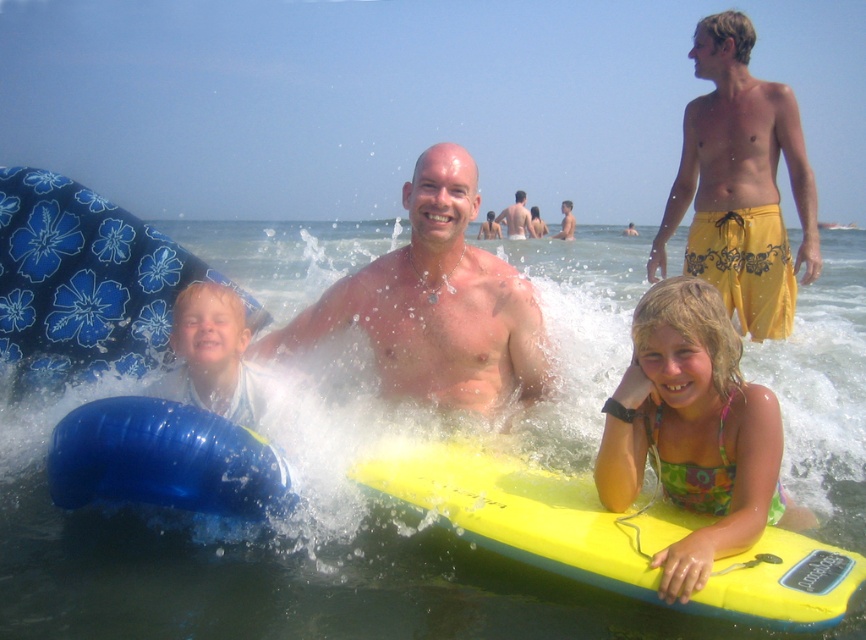
Does bald head at center appear on the right side of smooth tan skin at center?

In fact, bald head at center is to the left of smooth tan skin at center.

Does bald head at center have a lesser height compared to smooth tan skin at center?

Correct, bald head at center is not as tall as smooth tan skin at center.

Who is more forward, (x=466, y=316) or (x=527, y=211)?

Positioned in front is point (x=466, y=316).

This screenshot has width=866, height=640. Identify the location of bald head at center. (435, 305).

Does yellow foam surfboard at center have a greater width compared to multicolored fabric bikini at lower right?

Yes.

This screenshot has height=640, width=866. What do you see at coordinates (530, 513) in the screenshot?
I see `yellow foam surfboard at center` at bounding box center [530, 513].

What are the coordinates of `yellow foam surfboard at center` in the screenshot? It's located at [530, 513].

Does yellow foam board at center lie behind smooth tan skin at center?

No, yellow foam board at center is closer to the viewer.

Is yellow foam board at center shorter than smooth tan skin at center?

Incorrect, yellow foam board at center's height does not fall short of smooth tan skin at center's.

Locate an element on the screen. The image size is (866, 640). yellow foam board at center is located at coordinates (263, 564).